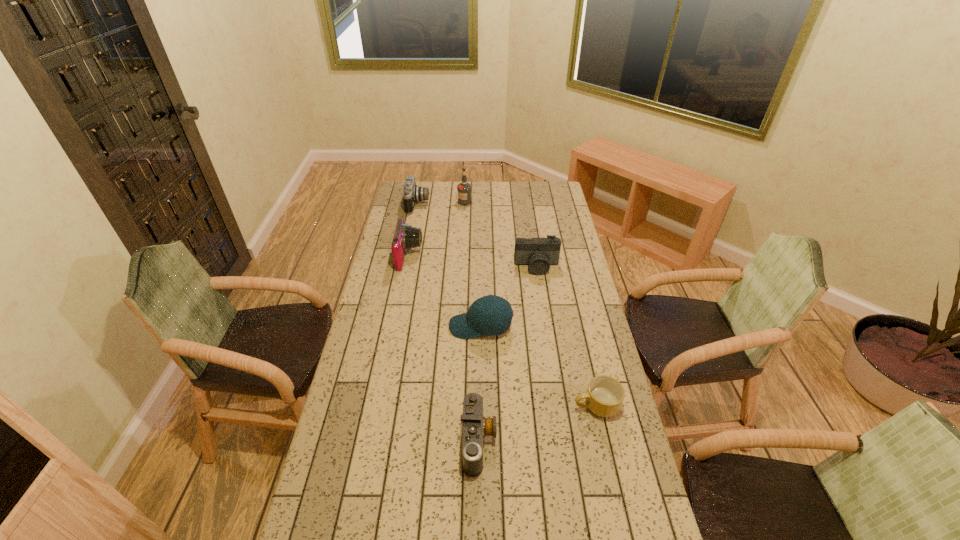
At what (x,y) coordinates should I click in order to perform the action: click on the tallest object. Please return your answer as a coordinate pair (x, y). Looking at the image, I should click on (464, 189).

Locate an element on the screen. the farthest camera is located at coordinates (412, 193).

This screenshot has height=540, width=960. I want to click on the fifth farthest object, so click(490, 315).

Find the location of a particular element. Image resolution: width=960 pixels, height=540 pixels. the rightmost camera is located at coordinates (538, 253).

Identify the location of the second shortest object. (475, 427).

Identify the location of the third camera from left to right. This screenshot has width=960, height=540. (475, 427).

At what (x,y) coordinates should I click in order to perform the action: click on mug. Please return your answer as a coordinate pair (x, y). Looking at the image, I should click on (604, 397).

This screenshot has width=960, height=540. I want to click on vacant region located 0.330m on the front label of the tallest object, so click(463, 242).

Identify the location of free space located on the front-facing side of the farthest camera. (489, 204).

The height and width of the screenshot is (540, 960). I want to click on vacant space located on the front-facing side of the third nearest object, so click(421, 326).